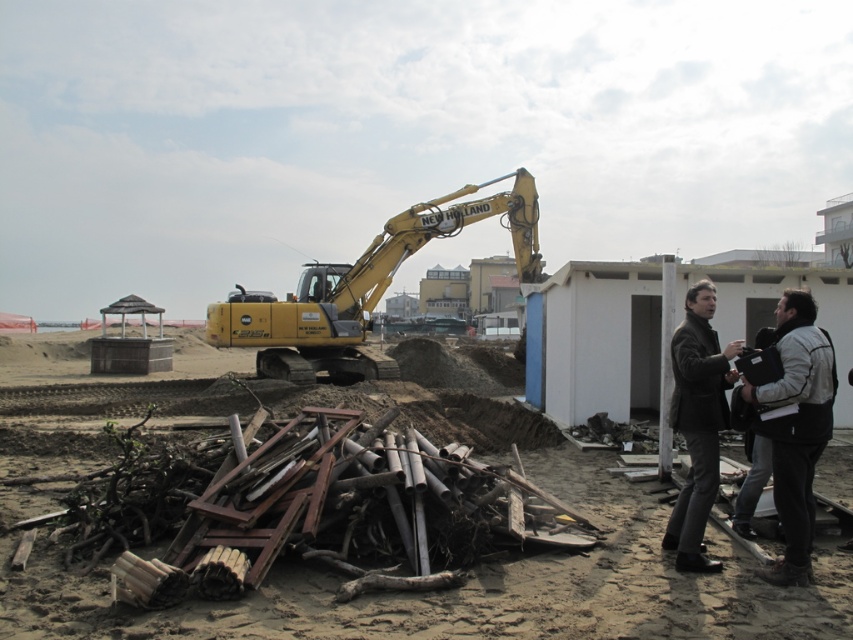
Is point (369, 292) behind point (787, 346)?

Yes, point (369, 292) is behind point (787, 346).

Does yellow metallic excavator at center appear on the right side of dark gray jacket at lower right?

No, yellow metallic excavator at center is not to the right of dark gray jacket at lower right.

Find the location of a particular element. This screenshot has width=853, height=640. yellow metallic excavator at center is located at coordinates (363, 289).

Can you confirm if brown sandy dirt at center is positioned to the right of dark gray jacket at lower right?

In fact, brown sandy dirt at center is to the left of dark gray jacket at lower right.

Does brown sandy dirt at center appear over dark gray jacket at lower right?

No.

Identify the location of brown sandy dirt at center. (422, 593).

Does point (814, 614) come farther from viewer compared to point (695, 404)?

No, it is not.

Find the location of a particular element. The image size is (853, 640). brown sandy dirt at center is located at coordinates (422, 593).